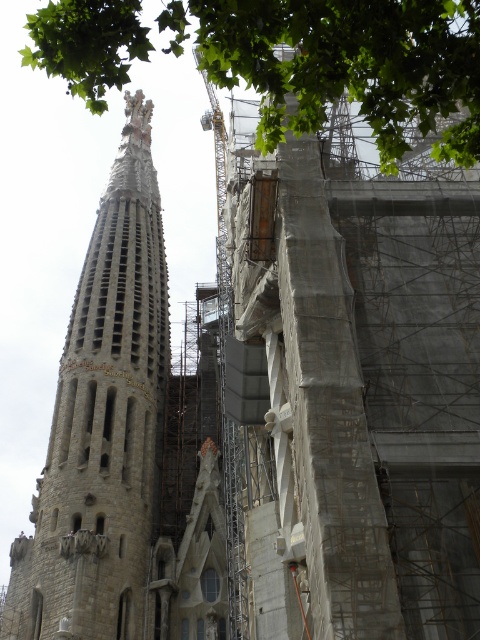
You are standing at the point marked as point (103, 422) in the image. What is the nearest object to you in the Sagrada Familia scene?

The nearest object to you at point (103, 422) is the stone tower at left.

In the scene shown: You are standing in front of the Sagrada Familia tower and looking at two points marked on the image. The first point is at coordinate point (48, 586) and the second is at point (45, 32). Which point is closer to you?

Point (48, 586) is further to the camera than point (45, 32), so the second point is closer to you.

Based on the scene of the Sagrada Familia, which object is taller between the stone tower at left and the green leafy tree at upper center?

The stone tower at left is taller than the green leafy tree at upper center according to the description.